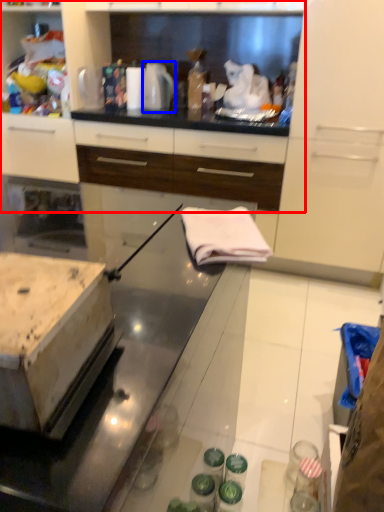
Question: Which of the following is the closest to the observer, cabinetry (highlighted by a red box) or kitchen appliance (highlighted by a blue box)?

Choices:
 (A) cabinetry
 (B) kitchen appliance

Answer: (A)